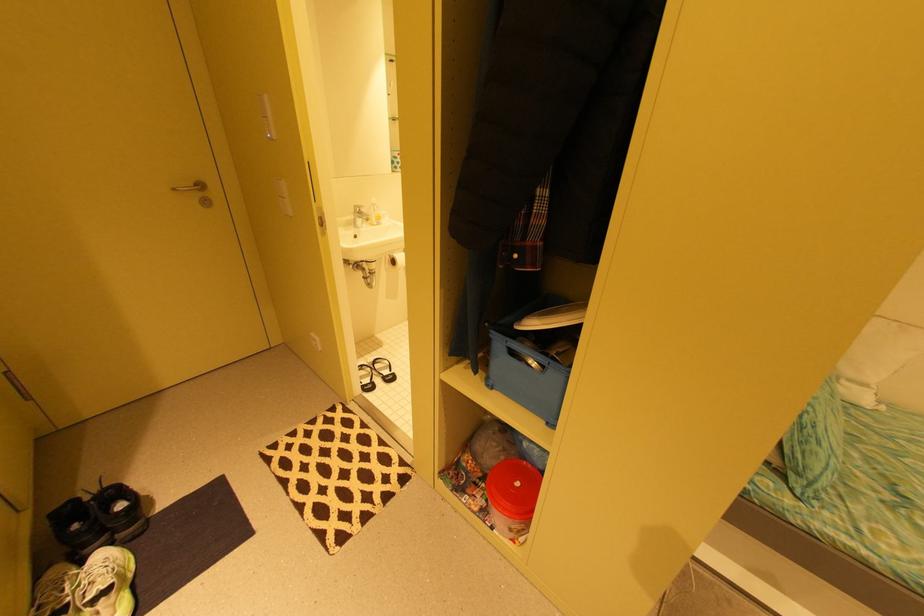
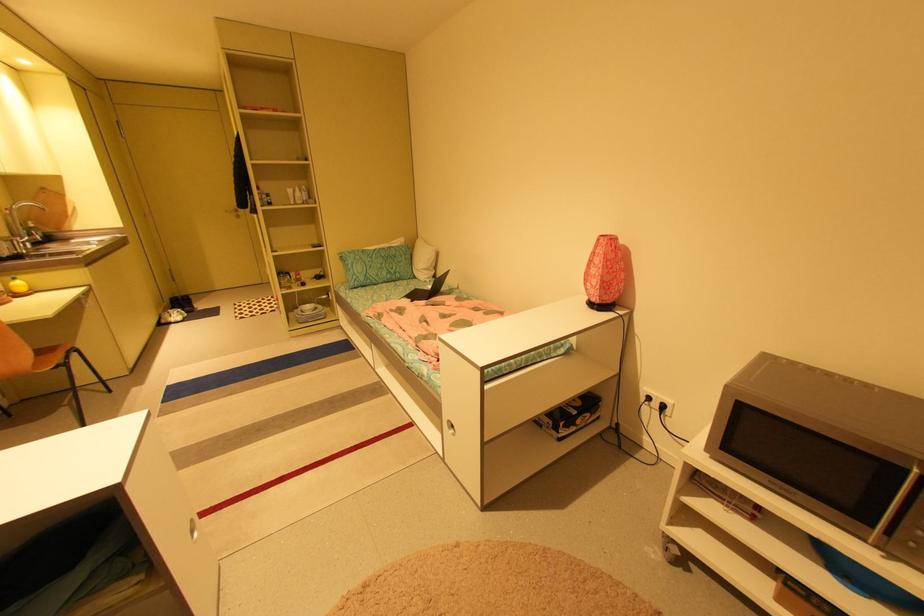
Locate, in the second image, the point that corresponds to (x=179, y=190) in the first image.

(232, 211)